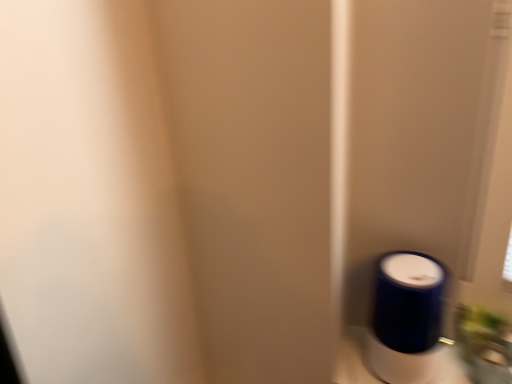
The width and height of the screenshot is (512, 384). What do you see at coordinates (406, 317) in the screenshot?
I see `matte blue toilet at lower right` at bounding box center [406, 317].

Measure the distance between point (426, 282) and camera.

32.56 inches.

I want to click on matte blue toilet at lower right, so click(x=406, y=317).

The width and height of the screenshot is (512, 384). What are the coordinates of `matte blue toilet at lower right` in the screenshot? It's located at (406, 317).